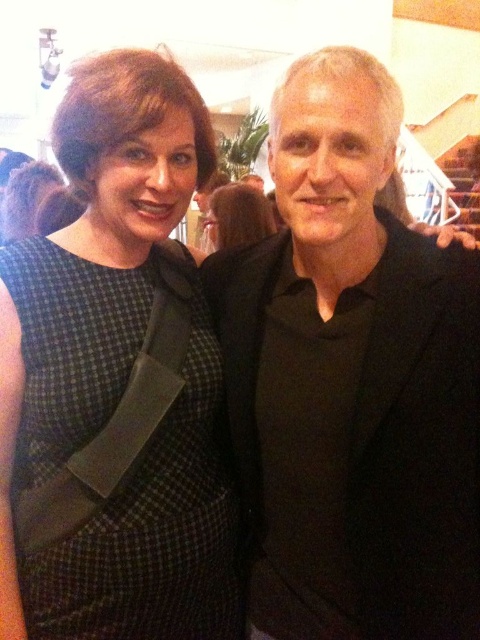
Which is more to the left, green checkered dress at left or dark brown hair at center?

Positioned to the left is green checkered dress at left.

The width and height of the screenshot is (480, 640). What do you see at coordinates (154, 532) in the screenshot?
I see `green checkered dress at left` at bounding box center [154, 532].

Locate an element on the screen. green checkered dress at left is located at coordinates (154, 532).

The width and height of the screenshot is (480, 640). Identify the location of green checkered dress at left. pyautogui.click(x=154, y=532).

Can you confirm if black matte suit at center is positioned to the left of green checkered dress at left?

No, black matte suit at center is not to the left of green checkered dress at left.

What do you see at coordinates (350, 380) in the screenshot?
I see `black matte suit at center` at bounding box center [350, 380].

Is point (338, 99) farther from camera compared to point (189, 408)?

That is False.

This screenshot has width=480, height=640. Identify the location of black matte suit at center. (350, 380).

Does black matte suit at center have a lesser height compared to dark brown hair at center?

Incorrect, black matte suit at center's height does not fall short of dark brown hair at center's.

Between black matte suit at center and dark brown hair at center, which one appears on the left side from the viewer's perspective?

dark brown hair at center is more to the left.

Who is more forward, [392,316] or [256,211]?

Point [392,316] is in front.

Find the location of a particular element. The width and height of the screenshot is (480, 640). black matte suit at center is located at coordinates (350, 380).